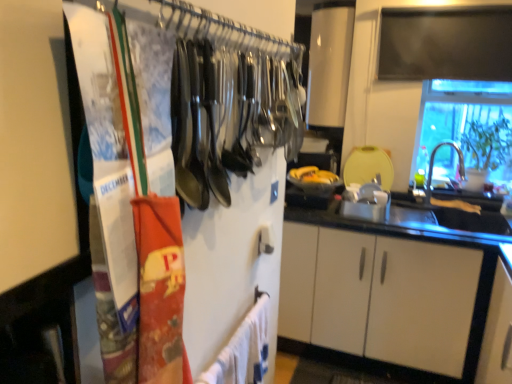
Question: Can you confirm if transparent glass window at upper right is positioned to the right of white cotton bath towel at lower center?

Choices:
 (A) no
 (B) yes

Answer: (B)

Question: Can you confirm if transparent glass window at upper right is thinner than white cotton bath towel at lower center?

Choices:
 (A) yes
 (B) no

Answer: (B)

Question: Can you confirm if transparent glass window at upper right is wider than white cotton bath towel at lower center?

Choices:
 (A) yes
 (B) no

Answer: (A)

Question: Is transparent glass window at upper right smaller than white cotton bath towel at lower center?

Choices:
 (A) yes
 (B) no

Answer: (B)

Question: Is transparent glass window at upper right located outside white cotton bath towel at lower center?

Choices:
 (A) yes
 (B) no

Answer: (A)

Question: Can you confirm if transparent glass window at upper right is bigger than white cotton bath towel at lower center?

Choices:
 (A) yes
 (B) no

Answer: (A)

Question: Considering the relative sizes of silver metallic faucet at right and transparent glass window at upper right in the image provided, is silver metallic faucet at right taller than transparent glass window at upper right?

Choices:
 (A) yes
 (B) no

Answer: (B)

Question: From the image's perspective, does silver metallic faucet at right appear lower than transparent glass window at upper right?

Choices:
 (A) yes
 (B) no

Answer: (A)

Question: Are silver metallic faucet at right and transparent glass window at upper right far apart?

Choices:
 (A) no
 (B) yes

Answer: (A)

Question: Can you confirm if silver metallic faucet at right is thinner than transparent glass window at upper right?

Choices:
 (A) no
 (B) yes

Answer: (B)

Question: From the image's perspective, is silver metallic faucet at right located above transparent glass window at upper right?

Choices:
 (A) yes
 (B) no

Answer: (B)

Question: Is silver metallic faucet at right wider than transparent glass window at upper right?

Choices:
 (A) yes
 (B) no

Answer: (B)

Question: Considering the relative sizes of metallic silver utensils at upper left and white cotton bath towel at lower center in the image provided, is metallic silver utensils at upper left bigger than white cotton bath towel at lower center?

Choices:
 (A) no
 (B) yes

Answer: (B)